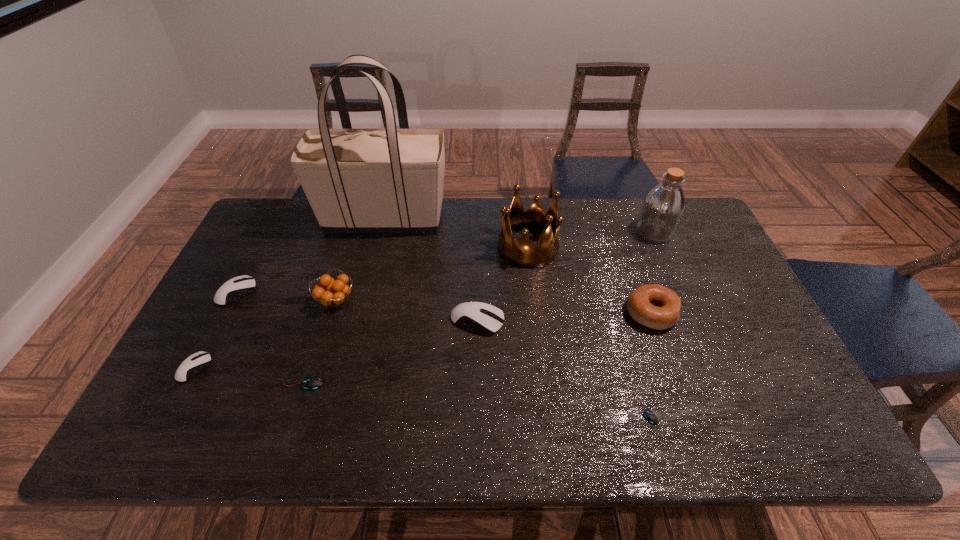
At what (x,y) coordinates should I click in order to perform the action: click on free space located on the left of the orange orange fruit. Please return your answer as a coordinate pair (x, y). Looking at the image, I should click on (275, 300).

Locate an element on the screen. free space located 0.200m on the back of the fifth tallest object is located at coordinates (629, 249).

Where is `vacant space situated on the front of the fourth mouse from left to right`? The height and width of the screenshot is (540, 960). vacant space situated on the front of the fourth mouse from left to right is located at coordinates (477, 416).

Locate an element on the screen. The image size is (960, 540). blank area located on the front of the farthest mouse is located at coordinates (163, 436).

Locate an element on the screen. The width and height of the screenshot is (960, 540). free space located 0.140m on the front of the smallest white mouse is located at coordinates (158, 438).

Locate an element on the screen. The height and width of the screenshot is (540, 960). free space located on the left of the bigger black mouse is located at coordinates (222, 384).

This screenshot has width=960, height=540. Find the location of `vacant region located on the left of the shortest object`. vacant region located on the left of the shortest object is located at coordinates (575, 409).

At what (x,y) coordinates should I click in order to perform the action: click on shopping bag that is at the far edge. Please return your answer as a coordinate pair (x, y). This screenshot has width=960, height=540. Looking at the image, I should click on (390, 180).

Find the location of `bottle situated at the far edge`. bottle situated at the far edge is located at coordinates (663, 207).

Find the location of a particular element. The image size is (960, 540). crown that is at the far edge is located at coordinates (522, 253).